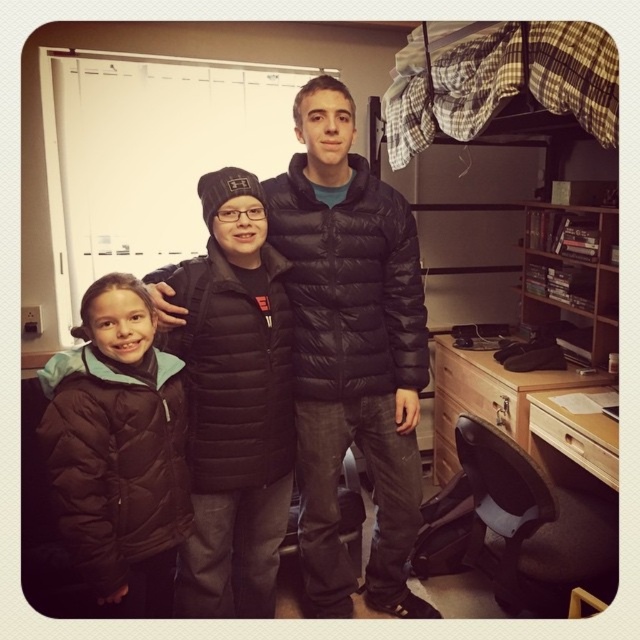
Question: Which object appears closest to the camera in this image?

Choices:
 (A) black puffer jacket at center
 (B) brown puffy jacket at left

Answer: (B)

Question: Can you confirm if matte black jacket at center is thinner than brown puffy jacket at left?

Choices:
 (A) no
 (B) yes

Answer: (A)

Question: Based on their relative distances, which object is nearer to the matte black jacket at center?

Choices:
 (A) black puffer jacket at center
 (B) brown puffy jacket at left

Answer: (B)

Question: Does black puffer jacket at center appear under matte black jacket at center?

Choices:
 (A) yes
 (B) no

Answer: (B)

Question: Does black puffer jacket at center lie in front of matte black jacket at center?

Choices:
 (A) no
 (B) yes

Answer: (A)

Question: Based on their relative distances, which object is nearer to the black puffer jacket at center?

Choices:
 (A) matte black jacket at center
 (B) brown puffy jacket at left

Answer: (A)